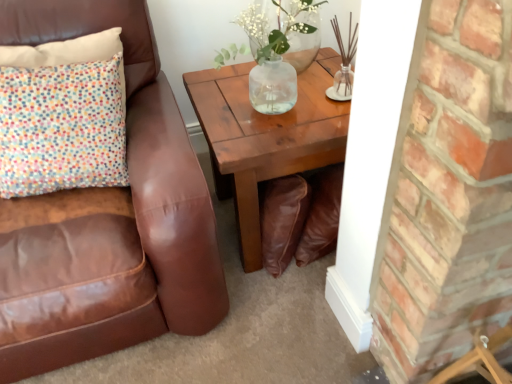
Question: Considering the positions of point (252, 241) and point (284, 31), is point (252, 241) closer or farther from the camera than point (284, 31)?

Choices:
 (A) farther
 (B) closer

Answer: (B)

Question: Based on their positions, is wooden coffee table at center located to the left or right of clear glass vase at upper center?

Choices:
 (A) left
 (B) right

Answer: (B)

Question: Which object is the closest to the brown leather chair at left?

Choices:
 (A) clear glass vase at upper center
 (B) wooden coffee table at center
 (C) multicolored fabric pillow at upper left

Answer: (C)

Question: Estimate the real-world distances between objects in this image. Which object is closer to the clear glass vase at upper center?

Choices:
 (A) brown leather chair at left
 (B) multicolored fabric pillow at upper left
 (C) wooden coffee table at center

Answer: (C)